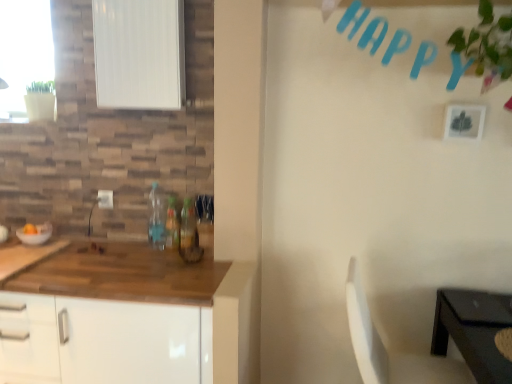
Find the location of a particular element. This screenshot has height=384, width=512. vacant area that is in front of translucent plastic bottle at center, which is counted as the 2th bottle, starting from the right is located at coordinates (167, 254).